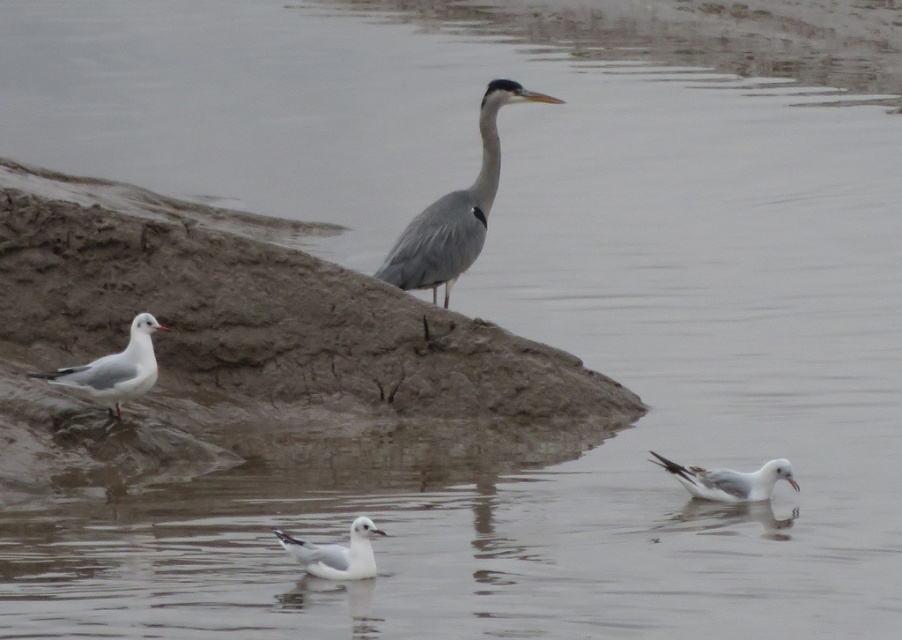
Question: Which point is farther to the camera?

Choices:
 (A) white matte seagull at center
 (B) white matte seagull at lower left
 (C) gray matte heron at center
 (D) white matte seagull at lower right

Answer: (C)

Question: Which point is closer to the camera?

Choices:
 (A) (354, 550)
 (B) (676, 474)
 (C) (72, 385)

Answer: (A)

Question: Can you confirm if white matte seagull at lower left is positioned to the left of white matte seagull at lower right?

Choices:
 (A) yes
 (B) no

Answer: (A)

Question: Which object is positioned closest to the gray matte heron at center?

Choices:
 (A) white matte seagull at center
 (B) white matte seagull at lower right
 (C) white matte seagull at lower left

Answer: (C)

Question: Does gray matte heron at center have a smaller size compared to white matte seagull at lower left?

Choices:
 (A) no
 (B) yes

Answer: (A)

Question: Is gray matte heron at center wider than white matte seagull at lower right?

Choices:
 (A) yes
 (B) no

Answer: (A)